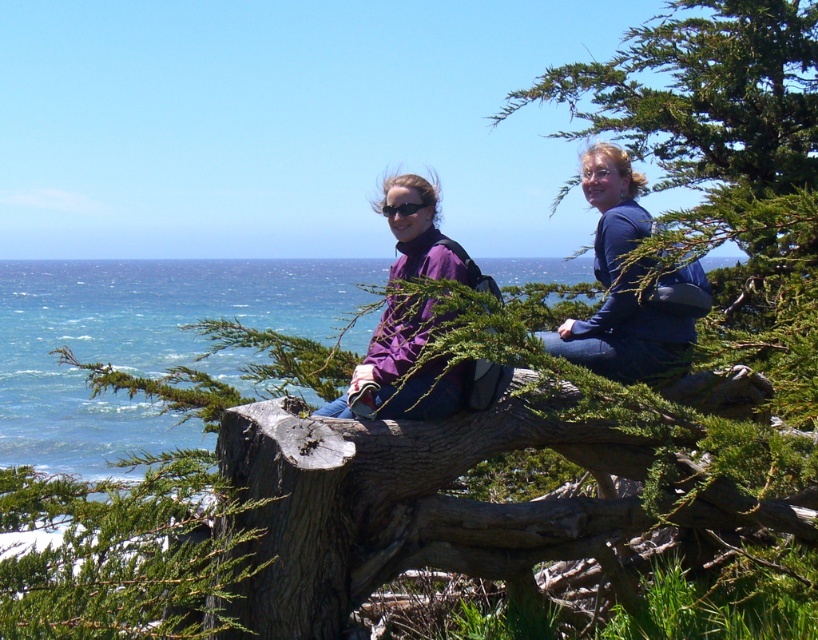
Is blue water at upper left above blue fabric jacket at upper center?

Yes.

At what (x,y) coordinates should I click in order to perform the action: click on blue water at upper left. Please return your answer as a coordinate pair (x, y). Looking at the image, I should click on (138, 342).

Can you confirm if blue water at upper left is bigger than purple matte jacket at center?

Correct, blue water at upper left is larger in size than purple matte jacket at center.

Is blue water at upper left below purple matte jacket at center?

No, blue water at upper left is not below purple matte jacket at center.

In the scene shown: Measure the distance between point (100,308) and camera.

Point (100,308) is 25.90 meters away from camera.

What are the coordinates of `blue water at upper left` in the screenshot? It's located at (138, 342).

This screenshot has width=818, height=640. Describe the element at coordinates (407, 500) in the screenshot. I see `brown rough tree trunk at center` at that location.

Between point (508, 400) and point (598, 346), which one is positioned in front?

Positioned in front is point (508, 400).

The width and height of the screenshot is (818, 640). What are the coordinates of `brown rough tree trunk at center` in the screenshot? It's located at tap(407, 500).